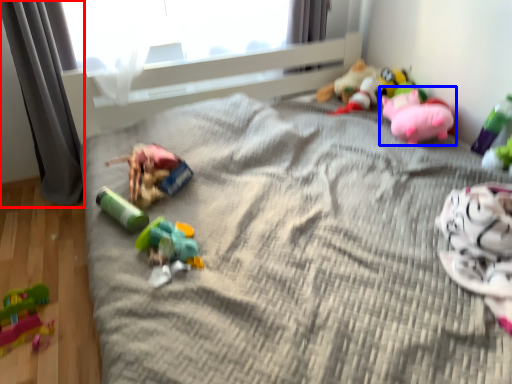
Question: Which point is closer to the camera, curtain (highlighted by a red box) or toy (highlighted by a blue box)?

Choices:
 (A) curtain
 (B) toy

Answer: (A)